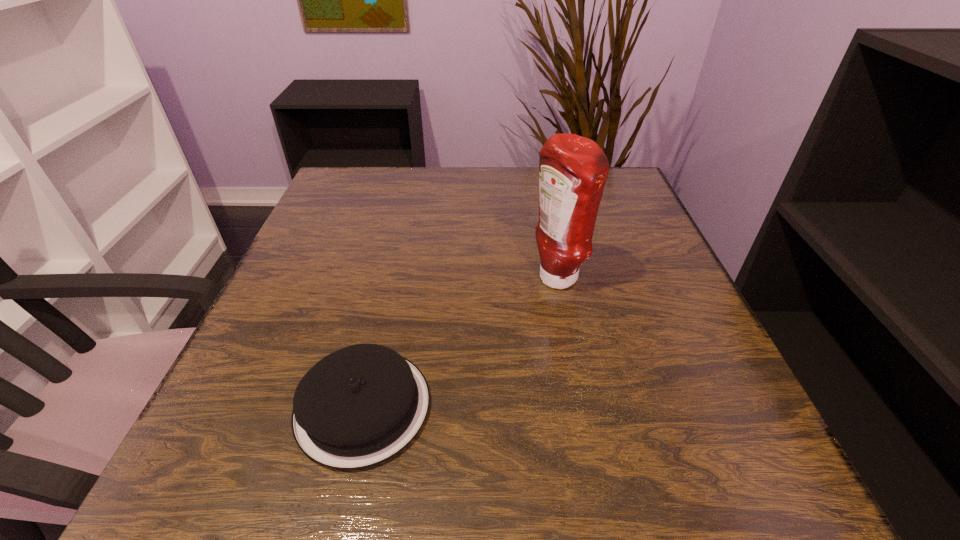
You are a GUI agent. You are given a task and a screenshot of the screen. Output one action in this format:
    pyautogui.click(x=<x>, y=<y>)
    Task: Click on the farther object
    The height and width of the screenshot is (540, 960).
    Given the screenshot: What is the action you would take?
    pyautogui.click(x=573, y=170)

Identify the location of condiment. This screenshot has width=960, height=540. (573, 170).

You are a GUI agent. You are given a task and a screenshot of the screen. Output one action in this format:
    pyautogui.click(x=<x>, y=<y>)
    Task: Click on the shorter object
    The width and height of the screenshot is (960, 540).
    Given the screenshot: What is the action you would take?
    pyautogui.click(x=361, y=405)

The width and height of the screenshot is (960, 540). What are the coordinates of `the nearer object` in the screenshot? It's located at (361, 405).

This screenshot has height=540, width=960. What are the coordinates of `vacant space located 0.120m on the back of the condiment` in the screenshot? It's located at (546, 228).

Where is `vacant space situated 0.090m on the back of the pancake`? The image size is (960, 540). vacant space situated 0.090m on the back of the pancake is located at coordinates (384, 315).

Where is `object that is at the near edge`? This screenshot has width=960, height=540. object that is at the near edge is located at coordinates coord(361,405).

Identify the location of object situated at the left edge. The image size is (960, 540). (361, 405).

Find the location of a particular element. This screenshot has width=960, height=540. object situated at the near left corner is located at coordinates (361, 405).

In the image, there is a desktop. At what (x,y) coordinates should I click in order to perform the action: click on vacant space at the far edge. Please return your answer as a coordinate pair (x, y). The width and height of the screenshot is (960, 540). Looking at the image, I should click on (535, 188).